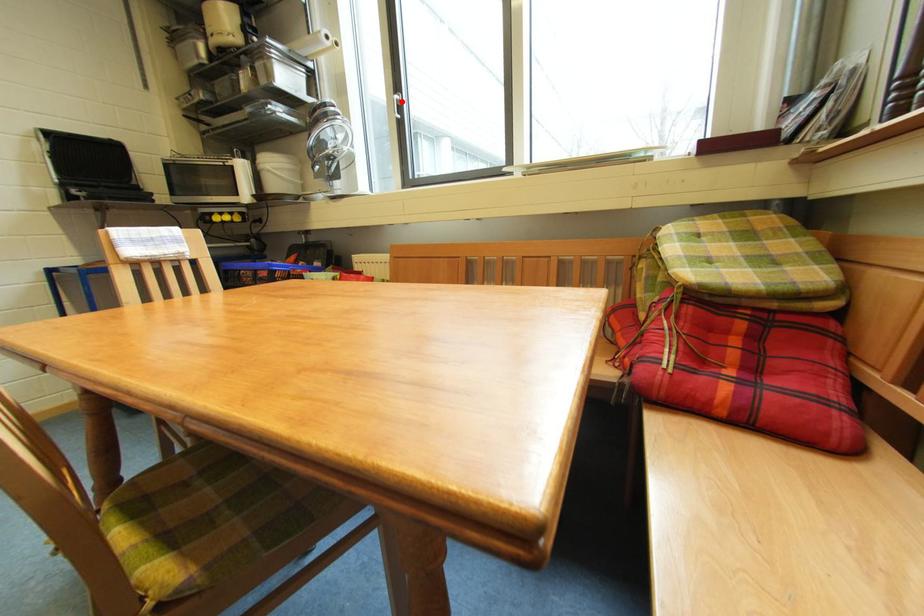
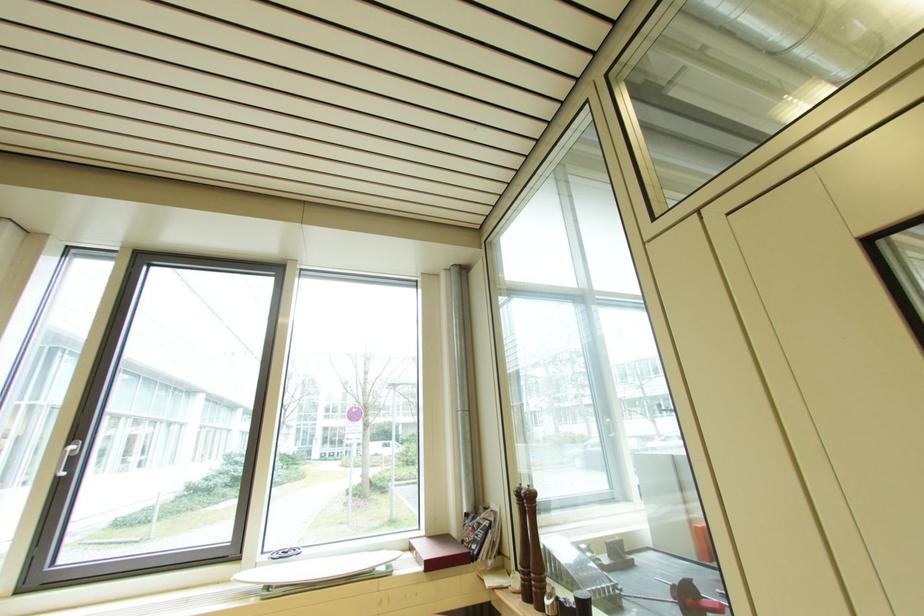
Question: I am providing you with two images of the same scene from different viewpoints. A red point is marked on the first image. Is the red point's position out of view in image 2?

Choices:
 (A) Yes
 (B) No

Answer: (B)